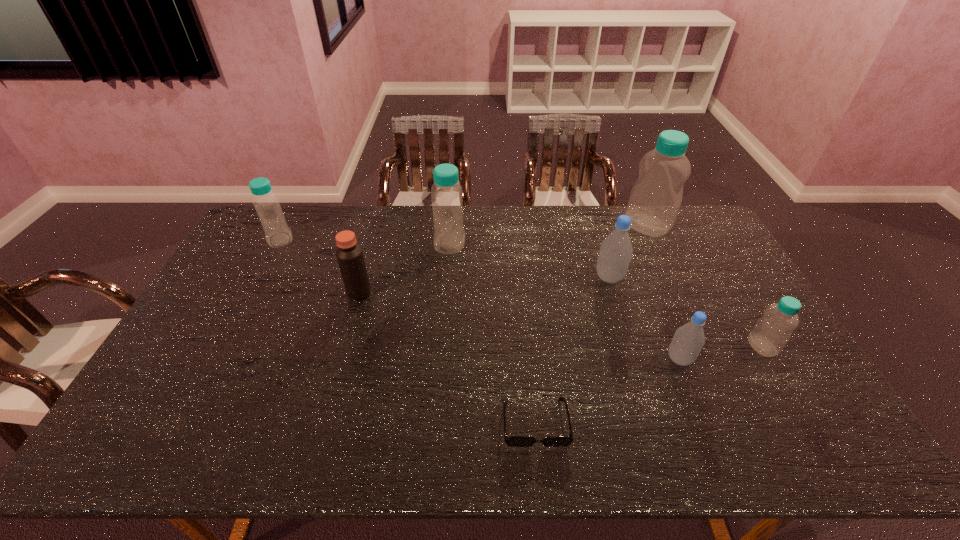
Locate an element on the screen. The width and height of the screenshot is (960, 540). vacant space that is in between the brown vinegar and the fifth bottle from right to left is located at coordinates (404, 268).

Locate an element on the screen. The width and height of the screenshot is (960, 540). object that stands as the closest to the seventh shortest object is located at coordinates (349, 254).

You are a GUI agent. You are given a task and a screenshot of the screen. Output one action in this format:
    pyautogui.click(x=<x>, y=<y>)
    Task: Click on the object that is the second nearest to the right gray bottle
    Image resolution: width=960 pixels, height=540 pixels.
    Given the screenshot: What is the action you would take?
    pyautogui.click(x=615, y=253)

Locate an element on the screen. bottle that can be found as the closest to the brown vinegar is located at coordinates pos(446,193).

At what (x,y) coordinates should I click in order to perform the action: click on the third closest bottle to the smallest blue bottle. Please return your answer as a coordinate pair (x, y). Looking at the image, I should click on (655, 199).

At what (x,y) coordinates should I click in order to perform the action: click on the third closest blue bottle to the nearer gray bottle. Please return your answer as a coordinate pair (x, y). The height and width of the screenshot is (540, 960). Looking at the image, I should click on (446, 193).

Locate an element on the screen. The image size is (960, 540). blue bottle that is the third closest one to the rightmost object is located at coordinates (277, 233).